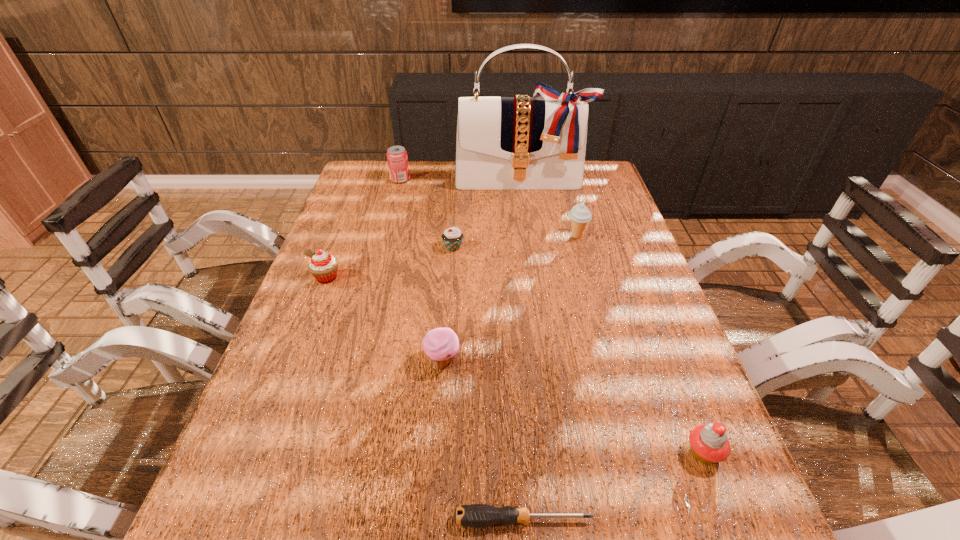
I want to click on the nearest object, so click(x=475, y=515).

At what (x,y) coordinates should I click in order to perform the action: click on vacant space located on the front-facing side of the satchel. Please return your answer as a coordinate pair (x, y). Image resolution: width=960 pixels, height=540 pixels. Looking at the image, I should click on (525, 210).

Locate an element on the screen. The width and height of the screenshot is (960, 540). vacant space located 0.180m on the front of the soda can is located at coordinates (391, 214).

Where is `vacant space positioned on the right of the icecream`? The height and width of the screenshot is (540, 960). vacant space positioned on the right of the icecream is located at coordinates (605, 237).

Locate an element on the screen. free space located on the right of the third nearest cupcake is located at coordinates (360, 278).

What are the coordinates of `free space located on the left of the farthest cupcake` in the screenshot? It's located at (368, 247).

Image resolution: width=960 pixels, height=540 pixels. I want to click on free space located on the back of the rightmost cupcake, so click(674, 377).

Find the location of a particular element. This screenshot has width=960, height=540. vacant space positioned 0.080m on the back of the third farthest cupcake is located at coordinates (445, 320).

Locate an element on the screen. This screenshot has height=540, width=960. free spot located on the left of the nearest object is located at coordinates (222, 520).

Locate an element on the screen. satchel situated at the far edge is located at coordinates coord(502,143).